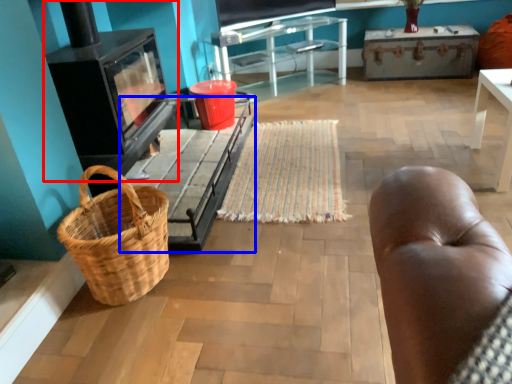
Question: Which point is closer to the camera, stove (highlighted by a red box) or table (highlighted by a blue box)?

Choices:
 (A) stove
 (B) table

Answer: (A)